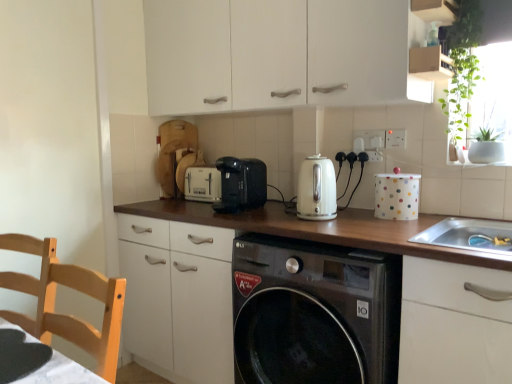
How much space does white plastic electric outlet at upper center, which appears as the second electric outlet when viewed from the right, occupy horizontally?

white plastic electric outlet at upper center, which appears as the second electric outlet when viewed from the right, is 1.40 centimeters in width.

What is the approximate height of light wood chair at left?

14.69 inches.

Image resolution: width=512 pixels, height=384 pixels. I want to click on white matte cabinet at upper center, so click(x=278, y=54).

Where is `white polka dot container at upper right, which is counted as the second appliance, starting from the back`? The image size is (512, 384). white polka dot container at upper right, which is counted as the second appliance, starting from the back is located at coordinates (397, 196).

Measure the distance between green leafy plant at upper right and camera.

green leafy plant at upper right and camera are 1.58 meters apart from each other.

This screenshot has width=512, height=384. What are the coordinates of `white plastic electric outlet at upper center, which appears as the second electric outlet when viewed from the right` in the screenshot? It's located at (371, 143).

Considering the relative sizes of green leafy plant at upper right and brown wood countertop at center in the image provided, is green leafy plant at upper right smaller than brown wood countertop at center?

Yes.

Is the position of green leafy plant at upper right less distant than that of brown wood countertop at center?

That is False.

Which of these two, green leafy plant at upper right or brown wood countertop at center, stands shorter?

Standing shorter between the two is green leafy plant at upper right.

From a real-world perspective, is green leafy plant at upper right positioned under brown wood countertop at center based on gravity?

No, from a real-world perspective, green leafy plant at upper right is not under brown wood countertop at center.

Is white glossy kettle at center located outside brown wood countertop at center?

That's correct, white glossy kettle at center is outside of brown wood countertop at center.

Can you confirm if white glossy kettle at center is bigger than brown wood countertop at center?

No.

Can you confirm if white glossy kettle at center is thinner than brown wood countertop at center?

Yes, white glossy kettle at center is thinner than brown wood countertop at center.

Is light wood chair at left at the back of green leafy plant at upper right?

No, green leafy plant at upper right's orientation is not away from light wood chair at left.

Considering the sizes of objects green leafy plant at upper right and light wood chair at left in the image provided, who is smaller, green leafy plant at upper right or light wood chair at left?

green leafy plant at upper right.

Which object is closer to the camera, green leafy plant at upper right or light wood chair at left?

light wood chair at left.

The height and width of the screenshot is (384, 512). I want to click on washing machine below the green leafy plant at upper right (from a real-world perspective), so click(314, 312).

Which is nearer, (x=311, y=265) or (x=478, y=78)?

Point (x=311, y=265) is positioned closer to the camera compared to point (x=478, y=78).

Looking at this image, measure the distance between black glossy washing machine at center and green leafy plant at upper right.

black glossy washing machine at center and green leafy plant at upper right are 36.73 inches apart from each other.

From a real-world perspective, is black glossy washing machine at center positioned over green leafy plant at upper right based on gravity?

No.

Between brown wood countertop at center and white polka dot container at upper right, which appears as the 1th appliance when viewed from the front, which one has more height?

brown wood countertop at center is taller.

Who is bigger, brown wood countertop at center or white polka dot container at upper right, the 1th appliance viewed from the right?

brown wood countertop at center.

From a real-world perspective, is brown wood countertop at center below white polka dot container at upper right, which is counted as the second appliance, starting from the back?

Indeed, from a real-world perspective, brown wood countertop at center is positioned beneath white polka dot container at upper right, which is counted as the second appliance, starting from the back.

Based on the photo, between brown wood countertop at center and white polka dot container at upper right, which appears as the 1th appliance when viewed from the front, which one has smaller width?

white polka dot container at upper right, which appears as the 1th appliance when viewed from the front, is thinner.

Which object is more forward, white plastic electric outlet at upper right, placed as the 1th electric outlet when sorted from front to back, or white matte cabinet at upper center?

white matte cabinet at upper center.

Are white plastic electric outlet at upper right, the second electric outlet when ordered from left to right, and white matte cabinet at upper center located far from each other?

No, white plastic electric outlet at upper right, the second electric outlet when ordered from left to right, is not far away from white matte cabinet at upper center.

Considering the relative sizes of white plastic electric outlet at upper right, the first electric outlet in the right-to-left sequence, and white matte cabinet at upper center in the image provided, is white plastic electric outlet at upper right, the first electric outlet in the right-to-left sequence, bigger than white matte cabinet at upper center?

No, white plastic electric outlet at upper right, the first electric outlet in the right-to-left sequence, is not bigger than white matte cabinet at upper center.

Between white plastic electric outlet at upper right, the 2th electric outlet viewed from the back, and white matte cabinet at upper center, which one has more height?

white matte cabinet at upper center is taller.

Is black matte table at lower left wider or thinner than green leafy plant at upper right?

In the image, black matte table at lower left appears to be wider than green leafy plant at upper right.

Who is shorter, black matte table at lower left or green leafy plant at upper right?

With less height is black matte table at lower left.

At what (x,y) coordinates should I click in order to perform the action: click on plant located on the right of black matte table at lower left. Please return your answer as a coordinate pair (x, y). The image size is (512, 384). Looking at the image, I should click on (462, 67).

Is black matte table at lower left bigger than green leafy plant at upper right?

Actually, black matte table at lower left might be smaller than green leafy plant at upper right.

Where is `countertop lying on the left of green leafy plant at upper right`? countertop lying on the left of green leafy plant at upper right is located at coordinates (228, 275).

Where is `kitchen appliance behind the brown wood countertop at center`? The height and width of the screenshot is (384, 512). kitchen appliance behind the brown wood countertop at center is located at coordinates (316, 189).

When comparing their distances from white glossy kettle at center, does black plastic toaster at center or green leafy plant at upper right seem closer?

black plastic toaster at center.

Considering their positions, is white plastic electric outlet at upper center, the 1th electric outlet viewed from the back, positioned further to white plastic toaster at center, which is the 1th appliance in back-to-front order, than green leafy plant at upper right?

The object further to white plastic toaster at center, which is the 1th appliance in back-to-front order, is green leafy plant at upper right.

Consider the image. Looking at the image, which one is located closer to white glossy kettle at center, white plastic toaster at center, which is the 2th appliance in right-to-left order, or white plastic electric outlet at upper center, which appears as the 1th electric outlet when viewed from the left?

white plastic electric outlet at upper center, which appears as the 1th electric outlet when viewed from the left, is closer to white glossy kettle at center.

Which object lies further to the anchor point black plastic toaster at center, green leafy plant at upper right or black matte table at lower left?

Among the two, black matte table at lower left is located further to black plastic toaster at center.

Consider the image. Considering their positions, is black glossy washing machine at center positioned further to white glossy kettle at center than light wood chair at left?

light wood chair at left.

From the image, which object appears to be nearer to white plastic toaster at center, which is the 2th appliance in right-to-left order, white plastic electric outlet at upper right, the second electric outlet when ordered from left to right, or brown wood countertop at center?

Based on the image, brown wood countertop at center appears to be nearer to white plastic toaster at center, which is the 2th appliance in right-to-left order.

Estimate the real-world distances between objects in this image. Which object is closer to white polka dot container at upper right, which appears as the 1th appliance when viewed from the front, green leafy plant at upper right or black matte table at lower left?

green leafy plant at upper right is closer to white polka dot container at upper right, which appears as the 1th appliance when viewed from the front.

When comparing their distances from white glossy kettle at center, does black glossy washing machine at center or black matte table at lower left seem closer?

Among the two, black glossy washing machine at center is located nearer to white glossy kettle at center.

Where is `washing machine between light wood chair at left and white plastic electric outlet at upper center, the 1th electric outlet viewed from the back, from left to right`? Image resolution: width=512 pixels, height=384 pixels. washing machine between light wood chair at left and white plastic electric outlet at upper center, the 1th electric outlet viewed from the back, from left to right is located at coordinates (314, 312).

The height and width of the screenshot is (384, 512). Identify the location of washing machine located between black matte table at lower left and green leafy plant at upper right in the left-right direction. (314, 312).

At what (x,y) coordinates should I click in order to perform the action: click on kitchen appliance positioned between black glossy washing machine at center and white plastic toaster at center, which is the first appliance in left-to-right order, from near to far. Please return your answer as a coordinate pair (x, y). Image resolution: width=512 pixels, height=384 pixels. Looking at the image, I should click on (316, 189).

The width and height of the screenshot is (512, 384). I want to click on countertop situated between black matte table at lower left and white polka dot container at upper right, which appears as the 1th appliance when viewed from the front, from left to right, so click(x=228, y=275).